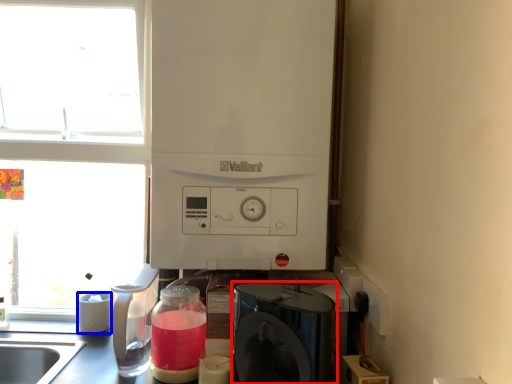
Question: Which of the following is the closest to the observer, home appliance (highlighted by a red box) or appliance (highlighted by a blue box)?

Choices:
 (A) home appliance
 (B) appliance

Answer: (A)